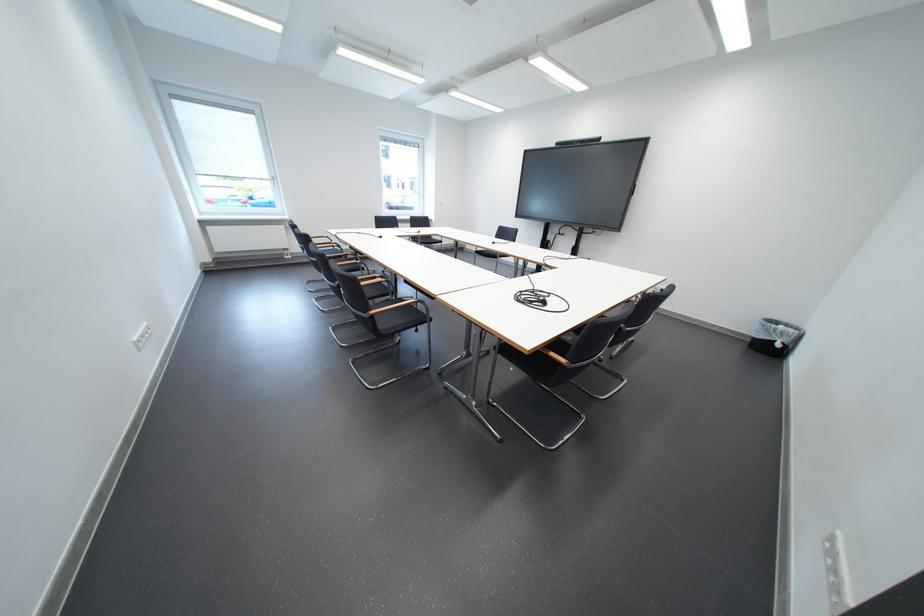
You are a GUI agent. You are given a task and a screenshot of the screen. Output one action in this format:
    pyautogui.click(x=<x>, y=<y>)
    Task: Click on the black trash can
    
    Given the screenshot: What is the action you would take?
    pyautogui.click(x=774, y=338)